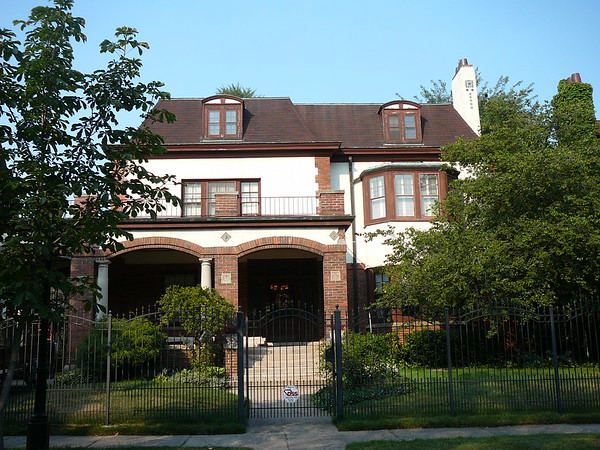
Identify the location of chimney. (463, 96).